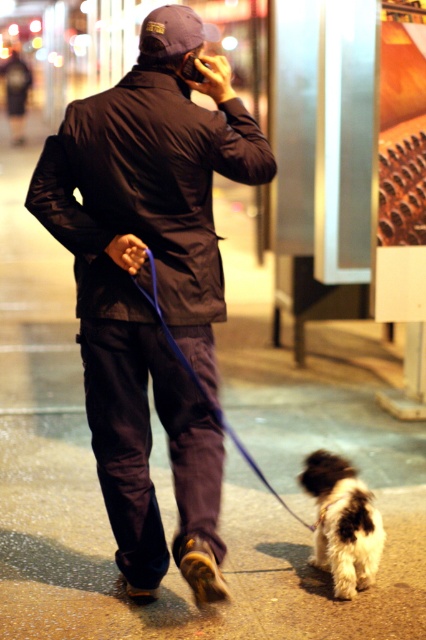
Question: Estimate the real-world distances between objects in this image. Which object is farther from the black plastic phone at upper center?

Choices:
 (A) blue fabric leash at lower center
 (B) matte black jacket at center
 (C) fluffy white dog at lower right

Answer: (C)

Question: Which object appears closest to the camera in this image?

Choices:
 (A) matte black jacket at center
 (B) fluffy white dog at lower right
 (C) black plastic phone at upper center
 (D) blue fabric leash at lower center

Answer: (A)

Question: Is the position of matte black jacket at center more distant than that of fluffy white dog at lower right?

Choices:
 (A) yes
 (B) no

Answer: (B)

Question: Can you confirm if matte black jacket at center is smaller than fluffy white dog at lower right?

Choices:
 (A) yes
 (B) no

Answer: (B)

Question: Does blue fabric leash at lower center have a smaller size compared to black plastic phone at upper center?

Choices:
 (A) yes
 (B) no

Answer: (B)

Question: Which of the following is the closest to the observer?

Choices:
 (A) (189, 76)
 (B) (42, 154)
 (C) (319, 506)

Answer: (B)